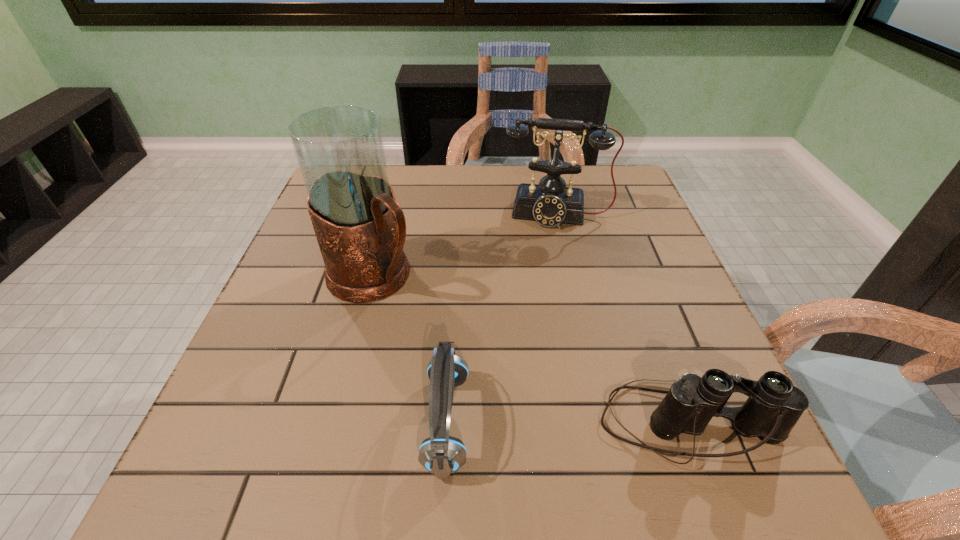
The height and width of the screenshot is (540, 960). Find the location of `object present at the far right corner`. object present at the far right corner is located at coordinates (551, 203).

Where is `object at the near right corner`? The width and height of the screenshot is (960, 540). object at the near right corner is located at coordinates (774, 406).

Where is `blank space at the far edge`? The image size is (960, 540). blank space at the far edge is located at coordinates (456, 199).

In the image, there is a desktop. Find the location of `vacant space at the near edge`. vacant space at the near edge is located at coordinates (395, 402).

Locate an element on the screen. free space at the left edge of the desktop is located at coordinates [318, 276].

In the image, there is a desktop. Where is `vacant space at the right edge`? This screenshot has height=540, width=960. vacant space at the right edge is located at coordinates (654, 343).

In the image, there is a desktop. Identify the location of free space at the near left corner. (285, 426).

Image resolution: width=960 pixels, height=540 pixels. In the image, there is a desktop. Identify the location of free region at the far right corner. (615, 167).

The height and width of the screenshot is (540, 960). I want to click on vacant point located between the binoculars and the tallest object, so click(531, 350).

Identify the location of vacant area that lies between the headset and the binoculars. (567, 422).